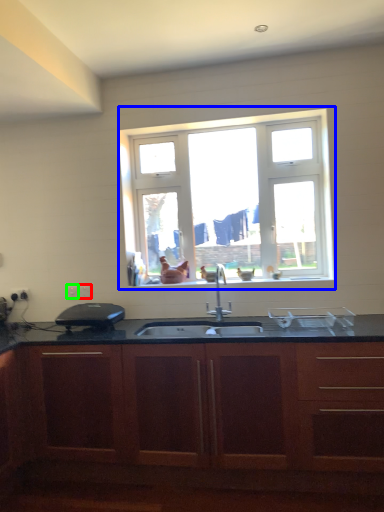
Question: Which object is the closest to the electric outlet (highlighted by a red box)? Choose among these: window (highlighted by a blue box) or electric outlet (highlighted by a green box).

Choices:
 (A) window
 (B) electric outlet

Answer: (B)